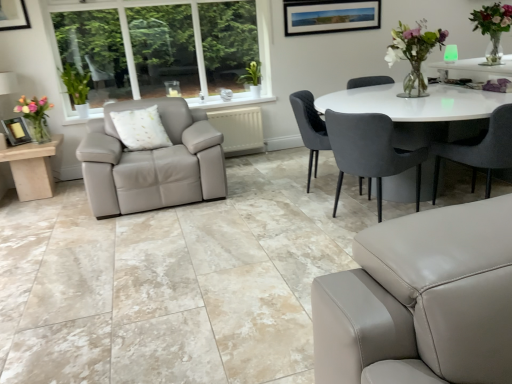
Locate an element on the screen. This screenshot has height=384, width=512. free space to the left of velvet dark gray chair at center, which is the second chair from right to left is located at coordinates (293, 229).